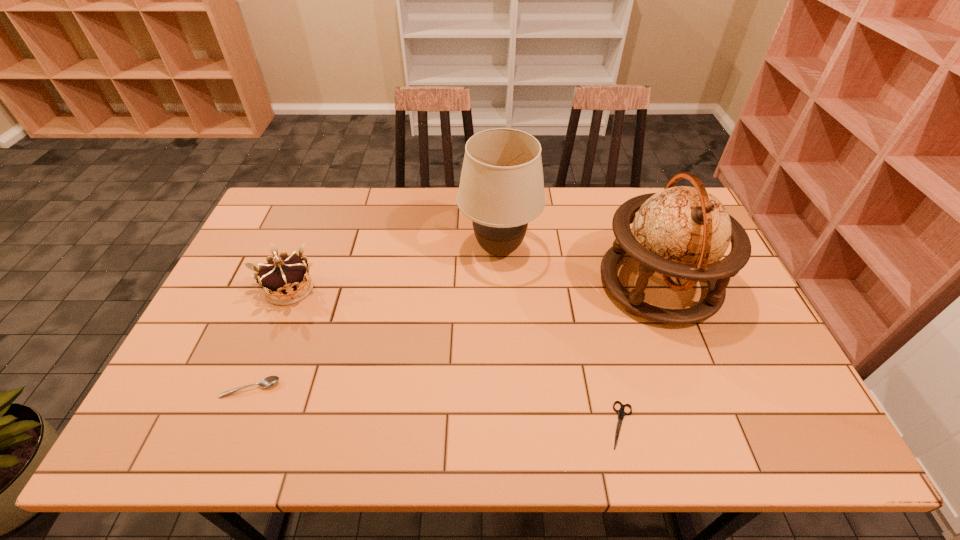
Locate an element on the screen. This screenshot has width=960, height=540. unoccupied position between the second shortest object and the nearest object is located at coordinates (436, 407).

This screenshot has width=960, height=540. Find the location of `blank region between the third object from right to left and the soupspoon`. blank region between the third object from right to left and the soupspoon is located at coordinates (374, 319).

You are a GUI agent. You are given a task and a screenshot of the screen. Output one action in this format:
    pyautogui.click(x=<x>, y=<y>)
    Task: Click on the object that can be found as the closest to the shears
    This screenshot has height=540, width=960.
    Given the screenshot: What is the action you would take?
    pyautogui.click(x=683, y=232)

At what (x,y) coordinates should I click in order to perform the action: click on object that can be found as the second closest to the lampshade. Please return your answer as a coordinate pair (x, y). Looking at the image, I should click on (285, 279).

The height and width of the screenshot is (540, 960). In order to click on vacant space that satisfies the following two spatial constraints: 1. on the front side of the second shortest object; 2. on the right side of the shears in this screenshot , I will do `click(235, 425)`.